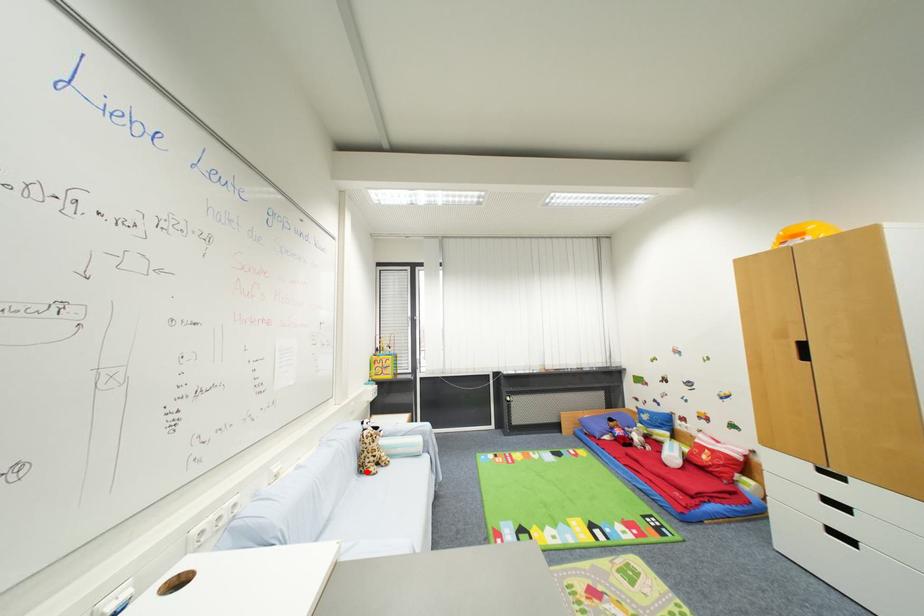
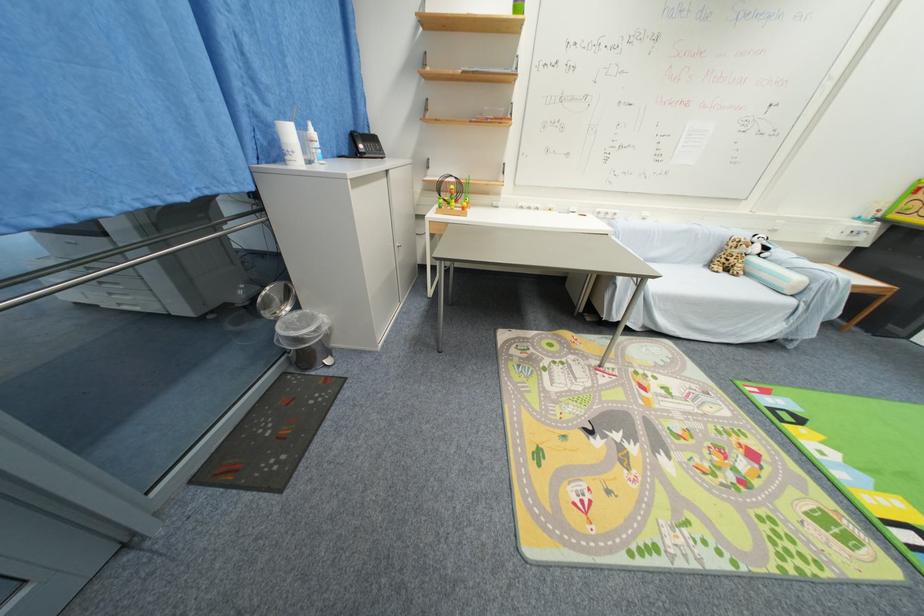
Question: I am providing you with two images of the same scene from different viewpoints. In image1, a red point is highlighted. Considering the same 3D point in image2, which of the following is correct?

Choices:
 (A) It is closer
 (B) It is farther

Answer: (A)